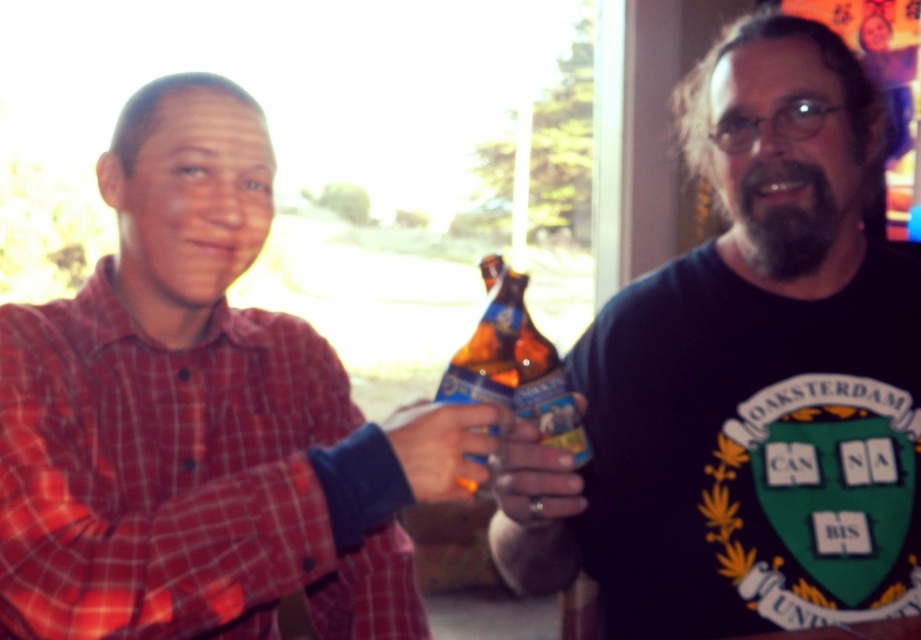
You are a photographer trying to capture a candid shot of both the red plaid shirt at left and the translucent plastic bottle at center. Since you want to include both in the frame, which object should you position closer to the edge of the photo to ensure both are visible?

The red plaid shirt at left should be positioned closer to the edge of the photo because it is on the left side of the translucent plastic bottle at center, allowing both to fit within the frame.

You are a bartender and need to place a coaster under the translucent plastic bottle at center to prevent condensation damage. The matte plastic ring at center is available. Will it fit under the bottle?

The matte plastic ring at center is shorter than the translucent plastic bottle at center, so it may not provide sufficient height to properly support the bottle and prevent condensation damage. A thicker coaster would be more appropriate.

You are a photographer trying to capture both the red plaid shirt at left and the matte plastic beer bottle at center in a single frame. Given that your camera has a fixed focal length, which object should you position closer to the camera to ensure both fit within the frame?

Since the red plaid shirt at left is wider than the matte plastic beer bottle at center, you should position the red plaid shirt at left closer to the camera to ensure both fit within the frame.